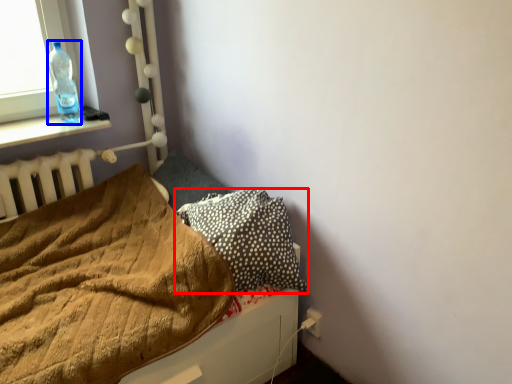
Question: Which object is closer to the camera taking this photo, pillow (highlighted by a red box) or bottle (highlighted by a blue box)?

Choices:
 (A) pillow
 (B) bottle

Answer: (A)